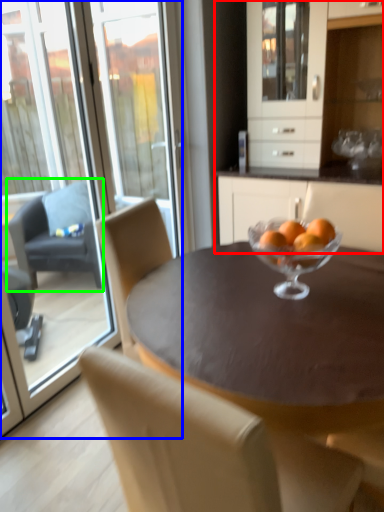
Question: Considering the real-world distances, which object is farthest from cabinetry (highlighted by a red box)? screen door (highlighted by a blue box) or chair (highlighted by a green box)?

Choices:
 (A) screen door
 (B) chair

Answer: (A)